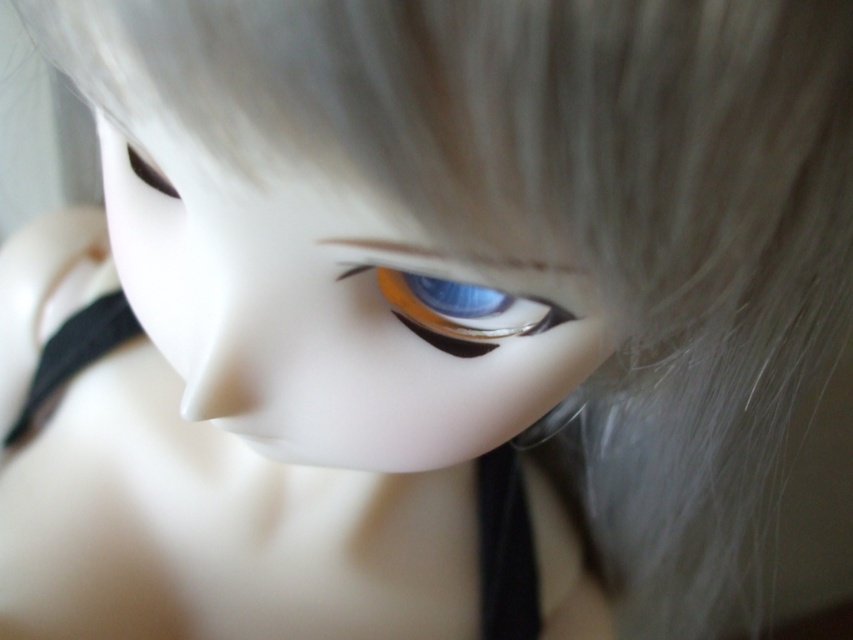
This screenshot has height=640, width=853. I want to click on blue glossy eye at center, so click(460, 310).

Describe the element at coordinates (460, 310) in the screenshot. This screenshot has width=853, height=640. I see `blue glossy eye at center` at that location.

Is point (524, 324) more distant than point (157, 172)?

No, it is not.

Find the location of a particular element. Image resolution: width=853 pixels, height=640 pixels. blue glossy eye at center is located at coordinates (460, 310).

Who is higher up, satin white doll face at center or black matte strap at lower center?

satin white doll face at center

Which is in front, point (294, 456) or point (492, 532)?

Point (294, 456) is more forward.

At what (x,y) coordinates should I click in order to perform the action: click on satin white doll face at center. Please return your answer as a coordinate pair (x, y). Looking at the image, I should click on (335, 321).

Can you confirm if satin white doll face at center is bigger than blue glossy eye at center?

Indeed, satin white doll face at center has a larger size compared to blue glossy eye at center.

What do you see at coordinates (335, 321) in the screenshot? The width and height of the screenshot is (853, 640). I see `satin white doll face at center` at bounding box center [335, 321].

Where is `satin white doll face at center`? satin white doll face at center is located at coordinates (335, 321).